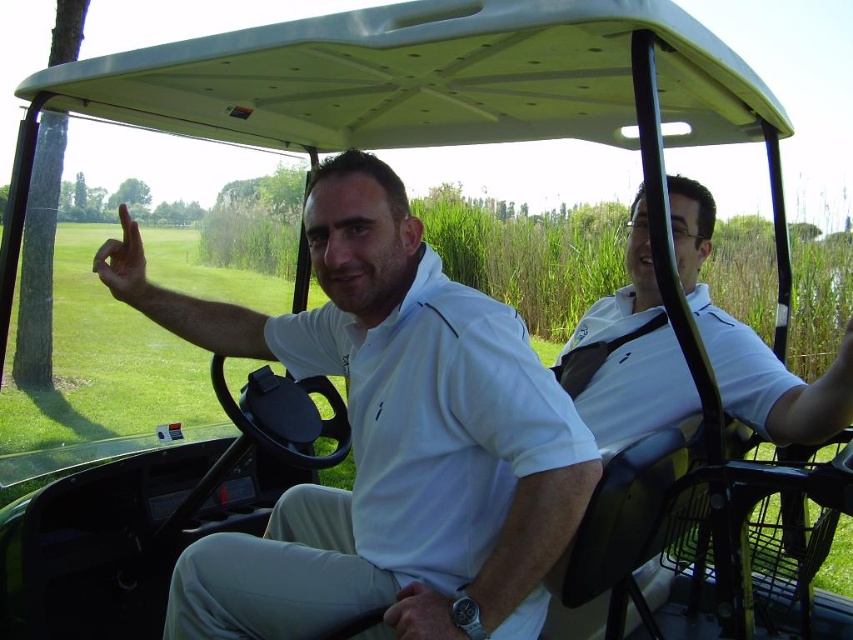
Question: Does white smooth shirt at center appear on the left side of white matte shirt at center?

Choices:
 (A) yes
 (B) no

Answer: (A)

Question: In this image, where is white smooth shirt at center located relative to white matte shirt at center?

Choices:
 (A) above
 (B) below

Answer: (B)

Question: Is white smooth shirt at center below white matte shirt at center?

Choices:
 (A) yes
 (B) no

Answer: (A)